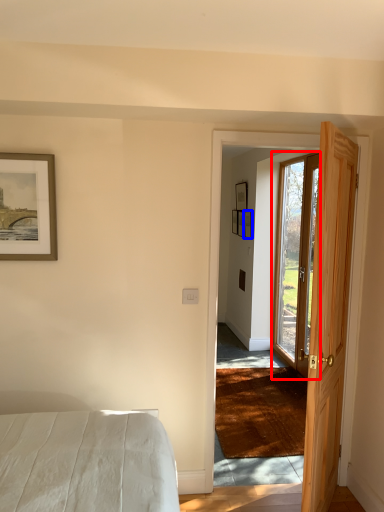
Question: Among these objects, which one is nearest to the camera, door (highlighted by a red box) or picture frame (highlighted by a blue box)?

Choices:
 (A) door
 (B) picture frame

Answer: (A)